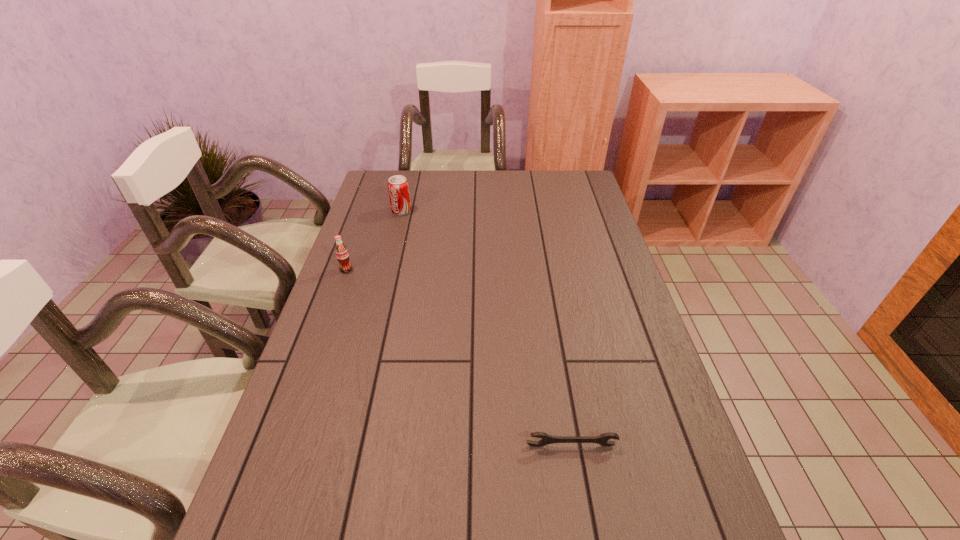
The height and width of the screenshot is (540, 960). I want to click on vacant space at the far edge, so click(492, 173).

In the image, there is a desktop. Identify the location of vacant area at the left edge. (356, 246).

In the image, there is a desktop. Identify the location of vacant space at the right edge. (579, 217).

Where is `free space at the far left corner of the desktop`? free space at the far left corner of the desktop is located at coordinates (376, 195).

Where is `free space at the far right corner`? free space at the far right corner is located at coordinates (564, 179).

The image size is (960, 540). Find the location of `free space between the leftmost object and the nearest object`. free space between the leftmost object and the nearest object is located at coordinates (459, 357).

I want to click on blank region between the shortest object and the leftmost object, so click(459, 357).

Where is `empty space between the right soda and the leftmost object`? Image resolution: width=960 pixels, height=540 pixels. empty space between the right soda and the leftmost object is located at coordinates (373, 240).

Choose which object is the nearest neighbor to the leftmost object. Please provide its 2D coordinates. Your answer should be formatted as a tuple, i.e. [(x, y)], where the tuple contains the x and y coordinates of a point satisfying the conditions above.

[(398, 188)]

Point out which object is positioned as the second nearest to the farther soda. Please provide its 2D coordinates. Your answer should be formatted as a tuple, i.e. [(x, y)], where the tuple contains the x and y coordinates of a point satisfying the conditions above.

[(603, 439)]